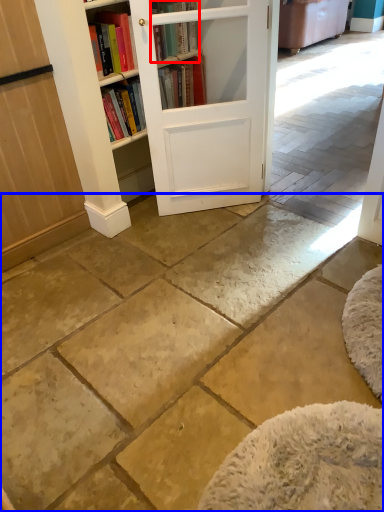
Question: Which of the following is the closest to the observer, book (highlighted by a red box) or concrete (highlighted by a blue box)?

Choices:
 (A) book
 (B) concrete

Answer: (B)